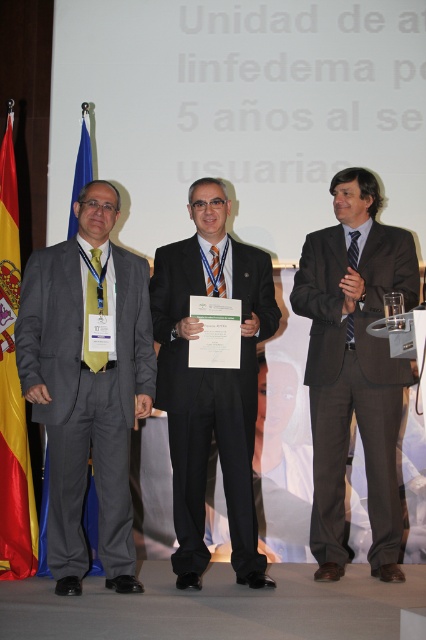
In the scene shown: You are an event photographer at the conference. You need to capture a photo where the matte gray suit at left and the red fabric flag at left are both visible. Based on their heights, which object will appear taller in the photo?

The red fabric flag at left will appear taller in the photo because it is taller than the matte gray suit at left.

In the scene of the formal event, there are two men wearing the matte gray suit at left and the black suit at center. Which one is standing lower in position compared to the other?

The matte gray suit at left is positioned under the black suit at center, so the man in the matte gray suit at left is standing lower in position compared to the man in the black suit at center.

Based on the scene description, which object is positioned higher in the image between the brown wool suit at center and the black suit at center?

The brown wool suit at center is positioned higher than the black suit at center in the image.